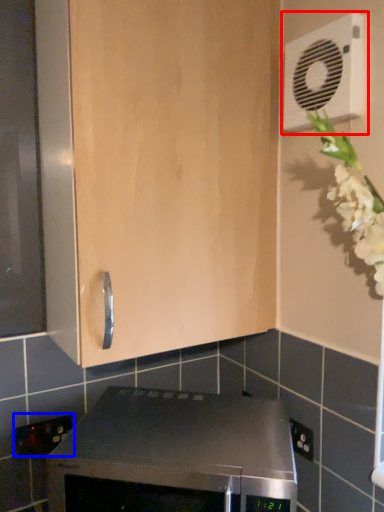
Question: Among these objects, which one is nearest to the camera, air conditioning (highlighted by a red box) or electric outlet (highlighted by a blue box)?

Choices:
 (A) air conditioning
 (B) electric outlet

Answer: (A)